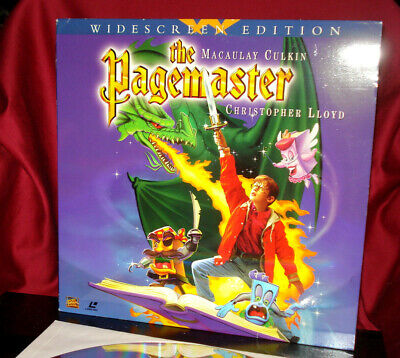
You are a GUI agent. You are given a task and a screenshot of the screen. Output one action in this format:
    pyautogui.click(x=<x>, y=<y>)
    Task: Click on the curtain
    This screenshot has height=358, width=400.
    Given the screenshot: What is the action you would take?
    pyautogui.click(x=31, y=140)